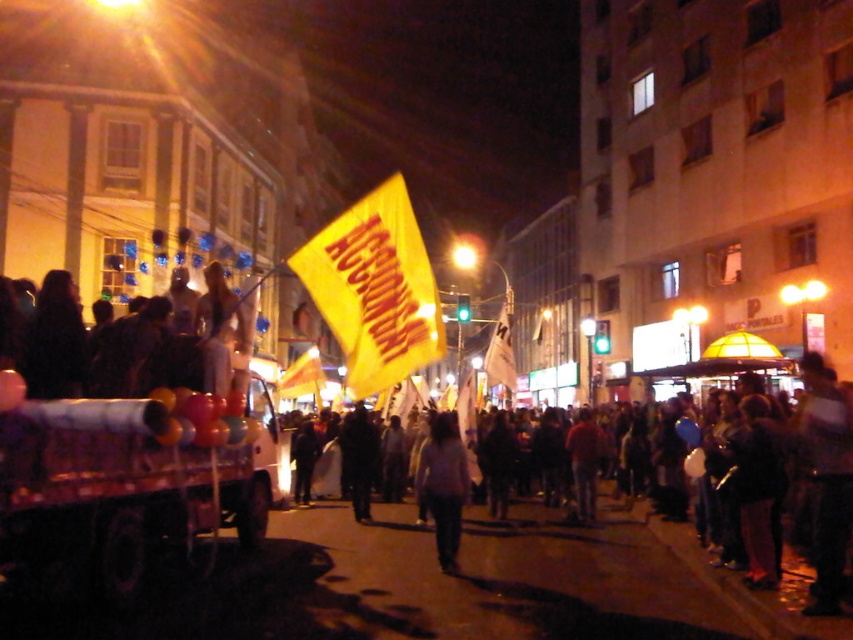
Which is above, light gray sweater at center or dark fabric jacket at center?

light gray sweater at center

Which is in front, point (430, 429) or point (376, 436)?

Point (430, 429) is more forward.

Which is in front, point (454, 492) or point (369, 502)?

Point (454, 492) is more forward.

Identify the location of light gray sweater at center. The width and height of the screenshot is (853, 640). (444, 484).

Is yellow paper flag at center above dark fabric jacket at center?

Incorrect, yellow paper flag at center is not positioned above dark fabric jacket at center.

Is point (395, 573) positioned after point (370, 440)?

No.

Where is `yellow paper flag at center`? This screenshot has width=853, height=640. yellow paper flag at center is located at coordinates (521, 577).

You are a GUI agent. You are given a task and a screenshot of the screen. Output one action in this format:
    pyautogui.click(x=<x>, y=<y>)
    Task: Click on the yellow paper flag at center
    
    Given the screenshot: What is the action you would take?
    pyautogui.click(x=521, y=577)

Does yellow paper flag at center have a greater height compared to dark clothing at left?

Yes, yellow paper flag at center is taller than dark clothing at left.

Is point (325, 620) closer to camera compared to point (91, 390)?

Yes.

I want to click on yellow paper flag at center, so click(521, 577).